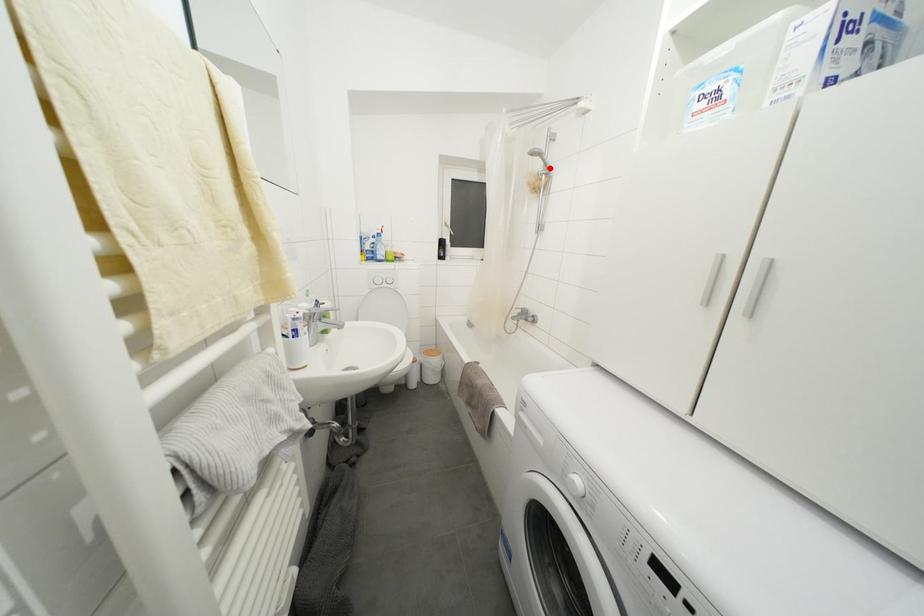
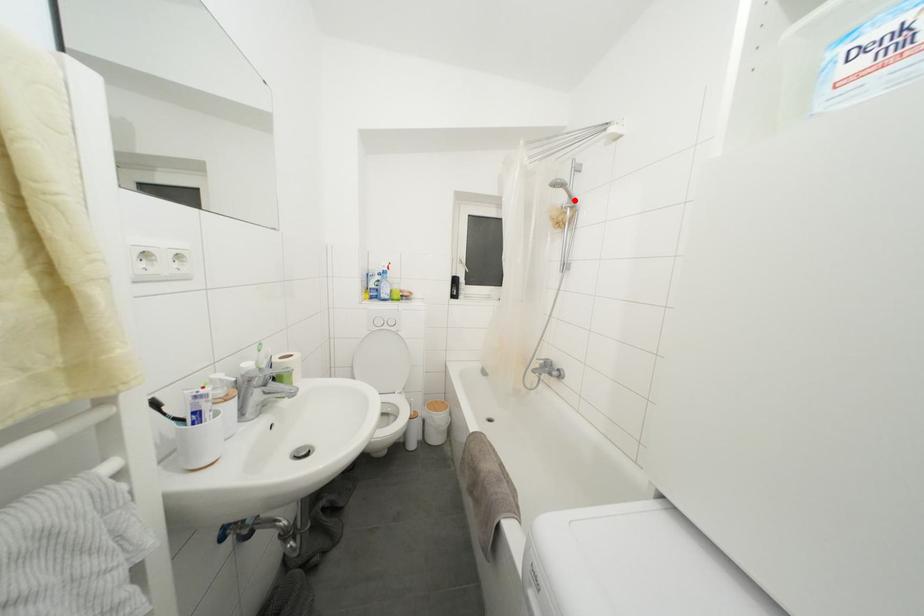
I am providing you with two images of the same scene from different viewpoints. A red point is marked on the first image and another point is marked on the second image. Is the marked point in image1 the same physical position as the marked point in image2?

Yes